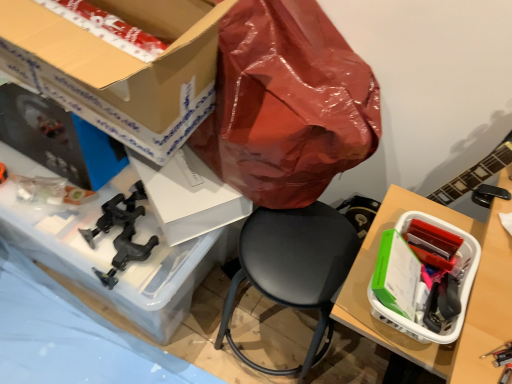
The image size is (512, 384). Find the location of `clear plastic container at lower left`. clear plastic container at lower left is located at coordinates (114, 254).

What do you see at coordinates (114, 254) in the screenshot? I see `clear plastic container at lower left` at bounding box center [114, 254].

Locate an element on the screen. This screenshot has height=384, width=512. white plastic basket at right, the 1th box positioned from the bottom is located at coordinates (459, 286).

Is there a large distance between white plastic basket at right, which is counted as the 2th box, starting from the left, and cardboard box at upper left, arranged as the 2th box when ordered from the bottom?

No, there isn't a large distance between white plastic basket at right, which is counted as the 2th box, starting from the left, and cardboard box at upper left, arranged as the 2th box when ordered from the bottom.

From a real-world perspective, which object stands above the other?

cardboard box at upper left, the 1th box viewed from the left.

Is cardboard box at upper left, which is the first box in top-to-bottom order, at the back of white plastic basket at right, the first box when ordered from right to left?

That's not correct — white plastic basket at right, the first box when ordered from right to left, is not looking away from cardboard box at upper left, which is the first box in top-to-bottom order.

How many degrees apart are the facing directions of clear plastic container at lower left and white plastic basket at right, which is counted as the 2th box, starting from the left?

The angle between the facing direction of clear plastic container at lower left and the facing direction of white plastic basket at right, which is counted as the 2th box, starting from the left, is 94 degrees.

Can you confirm if clear plastic container at lower left is positioned to the left of white plastic basket at right, the 1th box positioned from the bottom?

Yes.

Do you think clear plastic container at lower left is within white plastic basket at right, which is counted as the 2th box, starting from the left, or outside of it?

clear plastic container at lower left is outside white plastic basket at right, which is counted as the 2th box, starting from the left.

Who is bigger, clear plastic container at lower left or white plastic basket at right, the first box when ordered from right to left?

With larger size is clear plastic container at lower left.

Which of these two, black leather chair at center or clear plastic container at lower left, is bigger?

clear plastic container at lower left.

Is black leather chair at center aimed at clear plastic container at lower left?

No, black leather chair at center does not turn towards clear plastic container at lower left.

Does black leather chair at center have a lesser height compared to clear plastic container at lower left?

No, black leather chair at center is not shorter than clear plastic container at lower left.

Can you confirm if cardboard box at upper left, which is the first box in top-to-bottom order, is smaller than black leather chair at center?

No.

In the scene shown: Does cardboard box at upper left, arranged as the 2th box when ordered from the bottom, have a greater height compared to black leather chair at center?

Incorrect, the height of cardboard box at upper left, arranged as the 2th box when ordered from the bottom, is not larger of that of black leather chair at center.

Image resolution: width=512 pixels, height=384 pixels. In order to click on the 2nd box in front of the black leather chair at center, counting from the anchor's position in this screenshot , I will do `click(120, 68)`.

Is black leather chair at center completely or partially inside cardboard box at upper left, the 1th box viewed from the left?

No.

From the image's perspective, who appears lower, black leather chair at center or cardboard box at upper left, which is the first box in top-to-bottom order?

black leather chair at center is shown below in the image.

Does black leather chair at center appear on the left side of cardboard box at upper left, arranged as the 2th box when ordered from the bottom?

No, black leather chair at center is not to the left of cardboard box at upper left, arranged as the 2th box when ordered from the bottom.

Is black leather chair at center positioned before cardboard box at upper left, which is counted as the 2th box, starting from the right?

No, the depth of black leather chair at center is greater than that of cardboard box at upper left, which is counted as the 2th box, starting from the right.

Considering the sizes of black leather chair at center and cardboard box at upper left, arranged as the 2th box when ordered from the bottom, in the image, is black leather chair at center taller or shorter than cardboard box at upper left, arranged as the 2th box when ordered from the bottom,?

In the image, black leather chair at center appears to be taller than cardboard box at upper left, arranged as the 2th box when ordered from the bottom.

From the image's perspective, is cardboard box at upper left, which is the first box in top-to-bottom order, beneath clear plastic container at lower left?

Actually, cardboard box at upper left, which is the first box in top-to-bottom order, appears above clear plastic container at lower left in the image.

You are a GUI agent. You are given a task and a screenshot of the screen. Output one action in this format:
    pyautogui.click(x=<x>, y=<y>)
    Task: Click on the desk below the cardboard box at upper left, the 1th box viewed from the left (from the image's perspective)
    
    Given the screenshot: What is the action you would take?
    pyautogui.click(x=114, y=254)

Are cardboard box at upper left, which is counted as the 2th box, starting from the right, and clear plastic container at lower left located far from each other?

No, cardboard box at upper left, which is counted as the 2th box, starting from the right, is in close proximity to clear plastic container at lower left.

Considering the relative sizes of white plastic basket at right, which is counted as the 2th box, starting from the left, and clear plastic container at lower left in the image provided, is white plastic basket at right, which is counted as the 2th box, starting from the left, taller than clear plastic container at lower left?

In fact, white plastic basket at right, which is counted as the 2th box, starting from the left, may be shorter than clear plastic container at lower left.

Considering the relative sizes of white plastic basket at right, the 1th box positioned from the bottom, and clear plastic container at lower left in the image provided, is white plastic basket at right, the 1th box positioned from the bottom, smaller than clear plastic container at lower left?

Indeed, white plastic basket at right, the 1th box positioned from the bottom, has a smaller size compared to clear plastic container at lower left.

From a real-world perspective, is white plastic basket at right, the 1th box positioned from the bottom, on clear plastic container at lower left?

Correct, in the physical world, white plastic basket at right, the 1th box positioned from the bottom, is higher than clear plastic container at lower left.

Considering the positions of points (422, 339) and (20, 223), is point (422, 339) farther from camera compared to point (20, 223)?

No, (422, 339) is in front of (20, 223).

In order to click on box on the left of the white plastic basket at right, which is counted as the 2th box, starting from the left in this screenshot , I will do `click(120, 68)`.

Find the location of a particular element. The width and height of the screenshot is (512, 384). desk above the white plastic basket at right, the first box when ordered from right to left (from the image's perspective) is located at coordinates (114, 254).

Based on their spatial positions, is clear plastic container at lower left or white plastic basket at right, which is the 2th box in top-to-bottom order, further from cardboard box at upper left, arranged as the 2th box when ordered from the bottom?

The object further to cardboard box at upper left, arranged as the 2th box when ordered from the bottom, is white plastic basket at right, which is the 2th box in top-to-bottom order.

Based on their spatial positions, is cardboard box at upper left, the 1th box viewed from the left, or clear plastic container at lower left further from black leather chair at center?

Among the two, cardboard box at upper left, the 1th box viewed from the left, is located further to black leather chair at center.

Looking at the image, which one is located closer to cardboard box at upper left, which is counted as the 2th box, starting from the right, black leather chair at center or white plastic basket at right, which is counted as the 2th box, starting from the left?

Based on the image, black leather chair at center appears to be nearer to cardboard box at upper left, which is counted as the 2th box, starting from the right.

Looking at the image, which one is located further to black leather chair at center, clear plastic container at lower left or cardboard box at upper left, the 1th box viewed from the left?

cardboard box at upper left, the 1th box viewed from the left, lies further to black leather chair at center than the other object.

Looking at the image, which one is located further to black leather chair at center, cardboard box at upper left, which is counted as the 2th box, starting from the right, or white plastic basket at right, which is the 2th box in top-to-bottom order?

Based on the image, cardboard box at upper left, which is counted as the 2th box, starting from the right, appears to be further to black leather chair at center.

Based on their spatial positions, is cardboard box at upper left, which is the first box in top-to-bottom order, or clear plastic container at lower left closer to white plastic basket at right, which is the 2th box in top-to-bottom order?

cardboard box at upper left, which is the first box in top-to-bottom order.

From the image, which object appears to be farther from clear plastic container at lower left, black leather chair at center or white plastic basket at right, the first box when ordered from right to left?

The object further to clear plastic container at lower left is white plastic basket at right, the first box when ordered from right to left.

From the image, which object appears to be farther from clear plastic container at lower left, cardboard box at upper left, which is counted as the 2th box, starting from the right, or white plastic basket at right, the 1th box positioned from the bottom?

white plastic basket at right, the 1th box positioned from the bottom, is positioned further to the anchor clear plastic container at lower left.

In order to click on chair between clear plastic container at lower left and white plastic basket at right, the first box when ordered from right to left, in the horizontal direction in this screenshot , I will do `click(294, 268)`.

In order to click on box between clear plastic container at lower left and white plastic basket at right, the first box when ordered from right to left in this screenshot , I will do `click(120, 68)`.

Identify the location of chair between cardboard box at upper left, the 1th box viewed from the left, and white plastic basket at right, which is the 2th box in top-to-bottom order, in the horizontal direction. The image size is (512, 384). (294, 268).

Locate an element on the screen. This screenshot has height=384, width=512. box located between clear plastic container at lower left and black leather chair at center in the left-right direction is located at coordinates pyautogui.click(x=120, y=68).